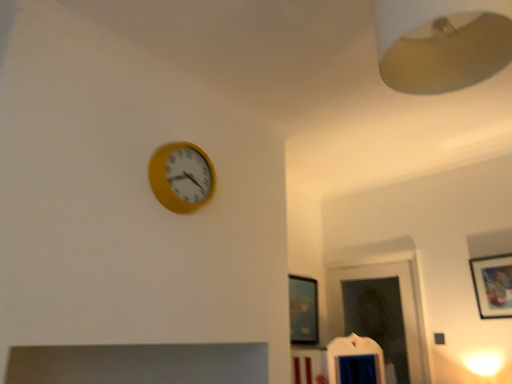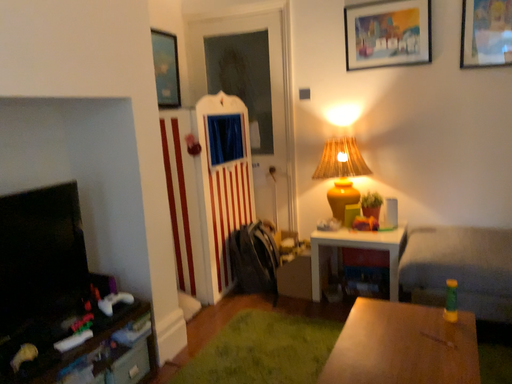
Question: Which way did the camera rotate in the video?

Choices:
 (A) rotated right
 (B) rotated left

Answer: (A)